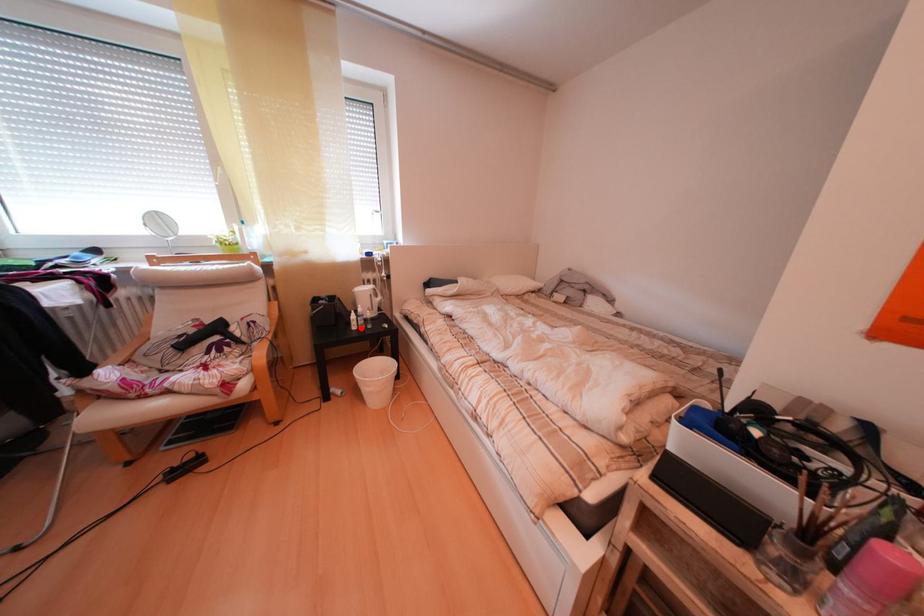
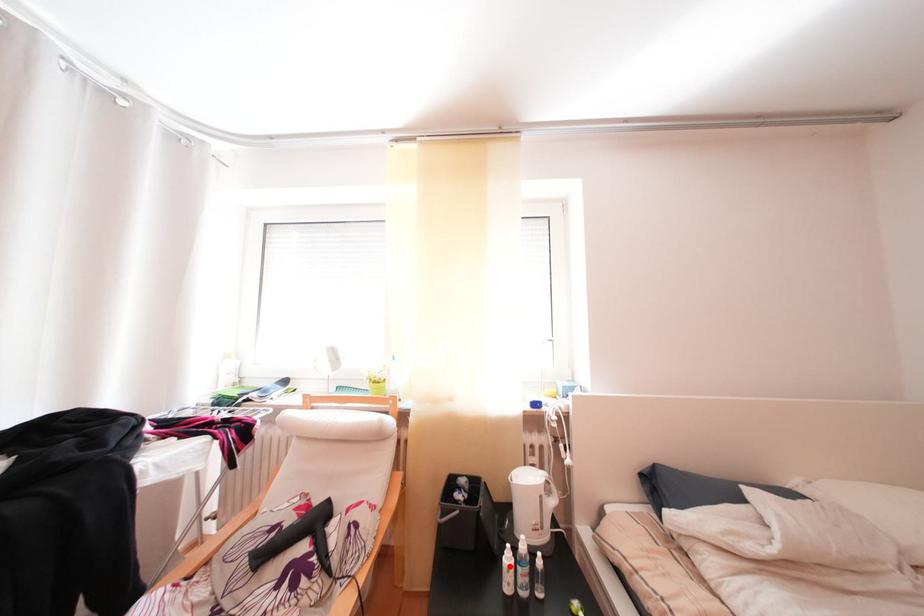
I am providing you with two images of the same scene from different viewpoints. A red point is marked on the first image and another point is marked on the second image. Do the highlighted points in image1 and image2 indicate the same real-world spot?

Yes